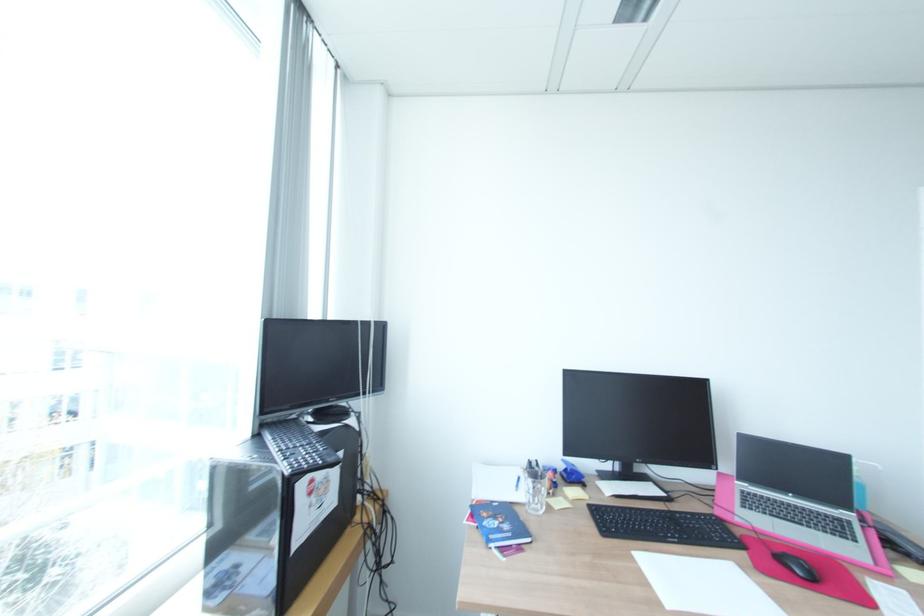
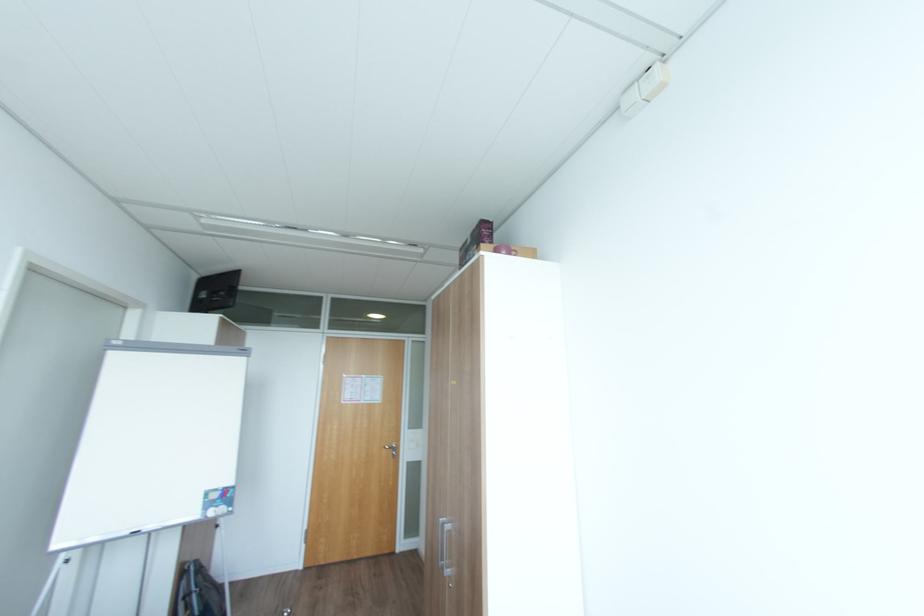
Question: The camera is either moving clockwise (left) or counter-clockwise (right) around the object. The first image is from the beginning of the video and the second image is from the end. Is the camera moving left or right when shooting the video?

Choices:
 (A) Left
 (B) Right

Answer: (A)